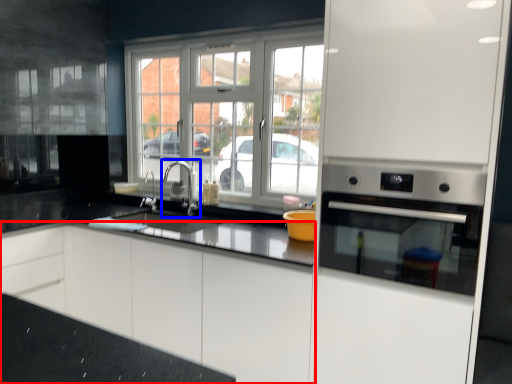
Question: Which of the following is the farthest to the observer, cabinetry (highlighted by a red box) or tap (highlighted by a blue box)?

Choices:
 (A) cabinetry
 (B) tap

Answer: (B)